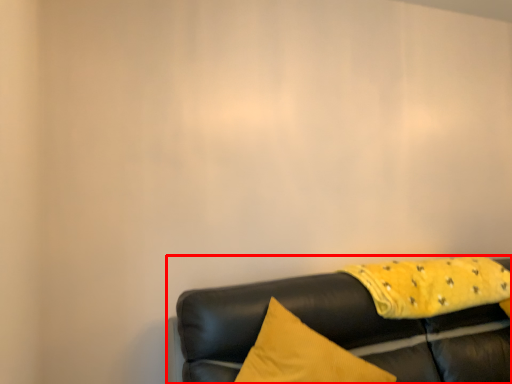
Question: From the image's perspective, what is the correct spatial positioning of studio couch (annotated by the red box) in reference to blanket?

Choices:
 (A) above
 (B) below

Answer: (B)